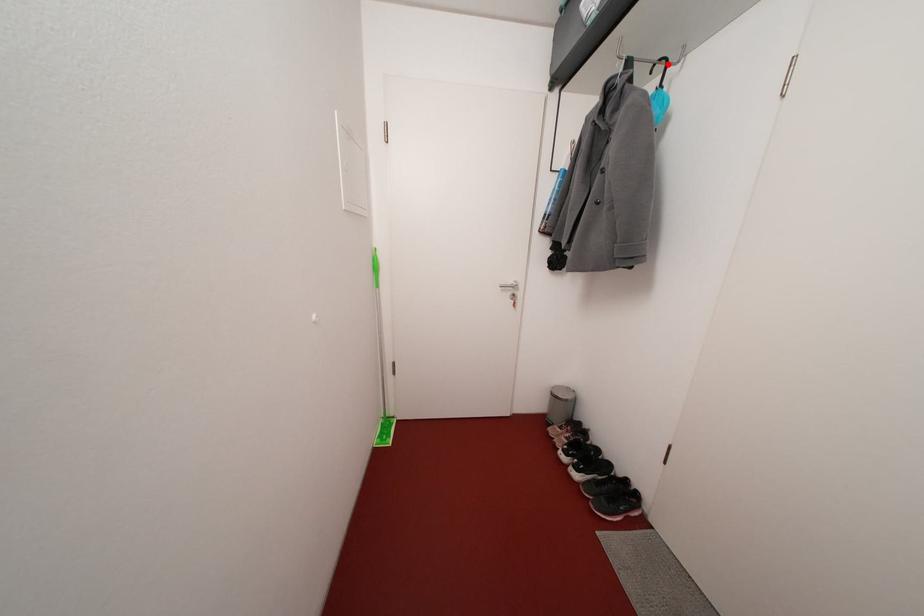
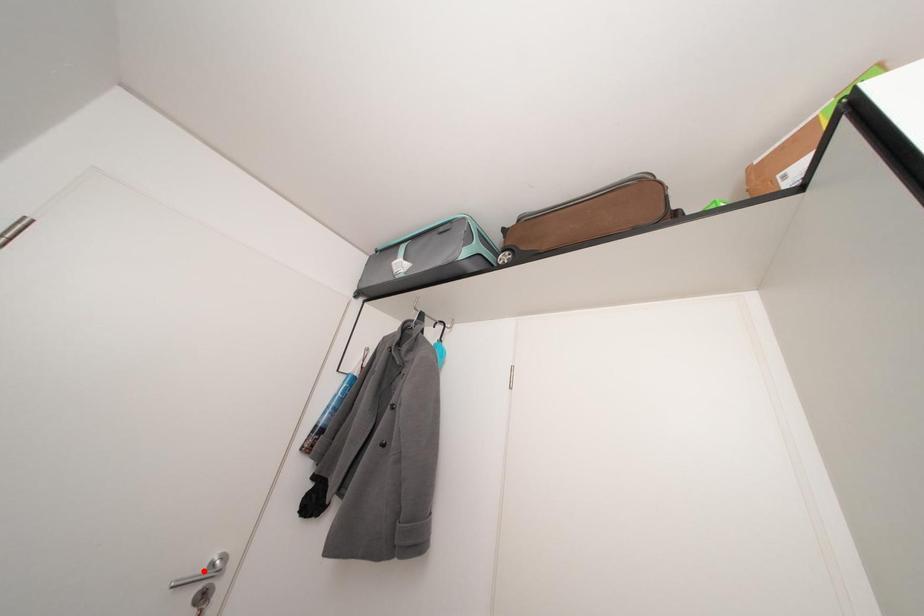
I am providing you with two images of the same scene from different viewpoints. A red point is marked on the first image and another point is marked on the second image. Is the marked point in image1 the same physical position as the marked point in image2?

No